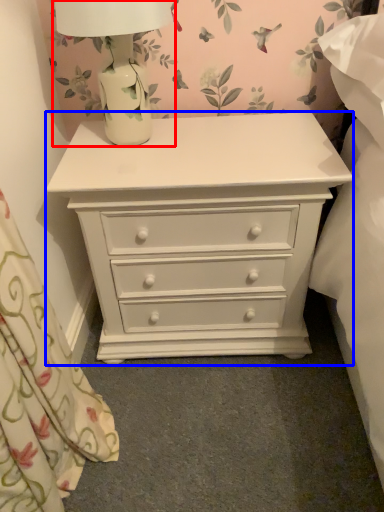
Question: Among these objects, which one is farthest to the camera, table lamp (highlighted by a red box) or chest of drawers (highlighted by a blue box)?

Choices:
 (A) table lamp
 (B) chest of drawers

Answer: (B)